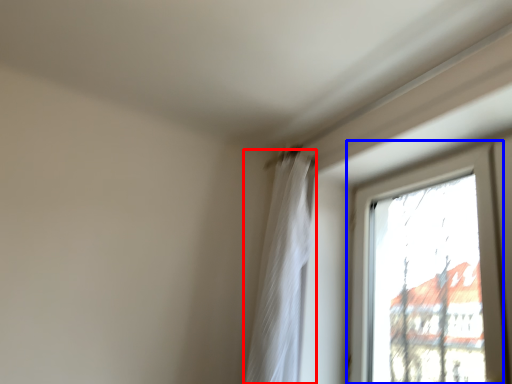
Question: Among these objects, which one is farthest to the camera, curtain (highlighted by a red box) or window (highlighted by a blue box)?

Choices:
 (A) curtain
 (B) window

Answer: (A)